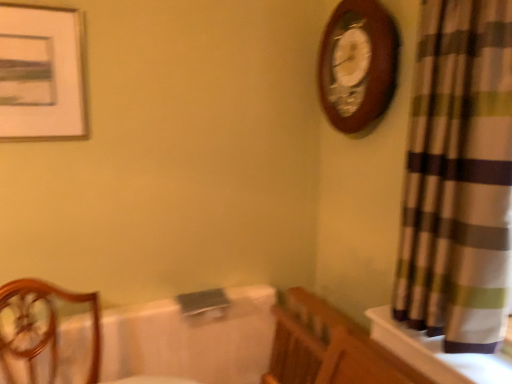
Question: From a real-world perspective, does white glossy bath at center stand above matte white picture frame at upper left?

Choices:
 (A) no
 (B) yes

Answer: (A)

Question: Is white glossy bath at center looking in the opposite direction of matte white picture frame at upper left?

Choices:
 (A) no
 (B) yes

Answer: (A)

Question: From a real-world perspective, is white glossy bath at center beneath matte white picture frame at upper left?

Choices:
 (A) yes
 (B) no

Answer: (A)

Question: Is white glossy bath at center facing towards matte white picture frame at upper left?

Choices:
 (A) yes
 (B) no

Answer: (B)

Question: Is white glossy bath at center in front of matte white picture frame at upper left?

Choices:
 (A) yes
 (B) no

Answer: (B)

Question: In the image, is plaid fabric curtain at right positioned in front of or behind wooden chair at left?

Choices:
 (A) front
 (B) behind

Answer: (A)

Question: Considering the positions of plaid fabric curtain at right and wooden chair at left in the image, is plaid fabric curtain at right wider or thinner than wooden chair at left?

Choices:
 (A) thin
 (B) wide

Answer: (A)

Question: Visually, is plaid fabric curtain at right positioned to the left or to the right of wooden chair at left?

Choices:
 (A) right
 (B) left

Answer: (A)

Question: Is plaid fabric curtain at right bigger or smaller than wooden chair at left?

Choices:
 (A) big
 (B) small

Answer: (A)

Question: Relative to plaid fabric curtain at right, is wooden chair at left in front or behind?

Choices:
 (A) behind
 (B) front

Answer: (A)

Question: Is point [x=23, y=309] closer or farther from the camera than point [x=501, y=122]?

Choices:
 (A) closer
 (B) farther

Answer: (B)

Question: Is wooden chair at left inside or outside of plaid fabric curtain at right?

Choices:
 (A) outside
 (B) inside

Answer: (A)

Question: From a real-world perspective, relative to plaid fabric curtain at right, is wooden chair at left vertically above or below?

Choices:
 (A) above
 (B) below

Answer: (B)

Question: In terms of height, does matte white picture frame at upper left look taller or shorter compared to wooden chair at left?

Choices:
 (A) short
 (B) tall

Answer: (B)

Question: From a real-world perspective, is matte white picture frame at upper left above or below wooden chair at left?

Choices:
 (A) below
 (B) above

Answer: (B)